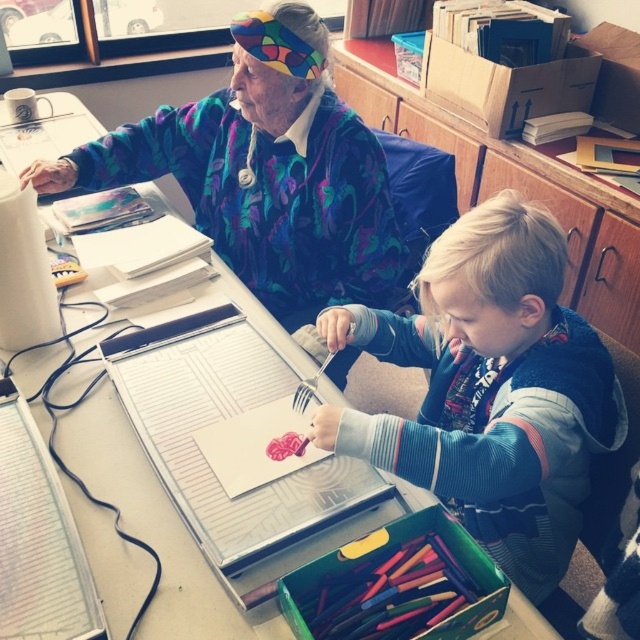
Find the location of `blue fleece sweater at center`. blue fleece sweater at center is located at coordinates (490, 388).

Which is in front, point (572, 438) or point (70, 180)?

Point (572, 438) is more forward.

Is point (472, 244) positioned behind point (68, 168)?

No, (472, 244) is closer to viewer.

Locate an element on the screen. Image resolution: width=640 pixels, height=640 pixels. blue fleece sweater at center is located at coordinates (490, 388).

Does blue fleece sweater at center lie in front of multicolored wax crayons at lower center?

No, blue fleece sweater at center is behind multicolored wax crayons at lower center.

Is the position of blue fleece sweater at center more distant than that of multicolored wax crayons at lower center?

Yes, it is behind multicolored wax crayons at lower center.

Measure the distance between point (602, 385) and camera.

98.83 centimeters

Where is `blue fleece sweater at center`? blue fleece sweater at center is located at coordinates 490,388.

Does floral sweater at upper left have a greater height compared to multicolored wax crayons at lower center?

Indeed, floral sweater at upper left has a greater height compared to multicolored wax crayons at lower center.

Does point (152, 122) come farther from viewer compared to point (429, 602)?

Yes, point (152, 122) is farther from viewer.

Is point (81, 173) behind point (449, 573)?

Yes, point (81, 173) is farther from viewer.

Locate an element on the screen. The image size is (640, 640). floral sweater at upper left is located at coordinates (266, 180).